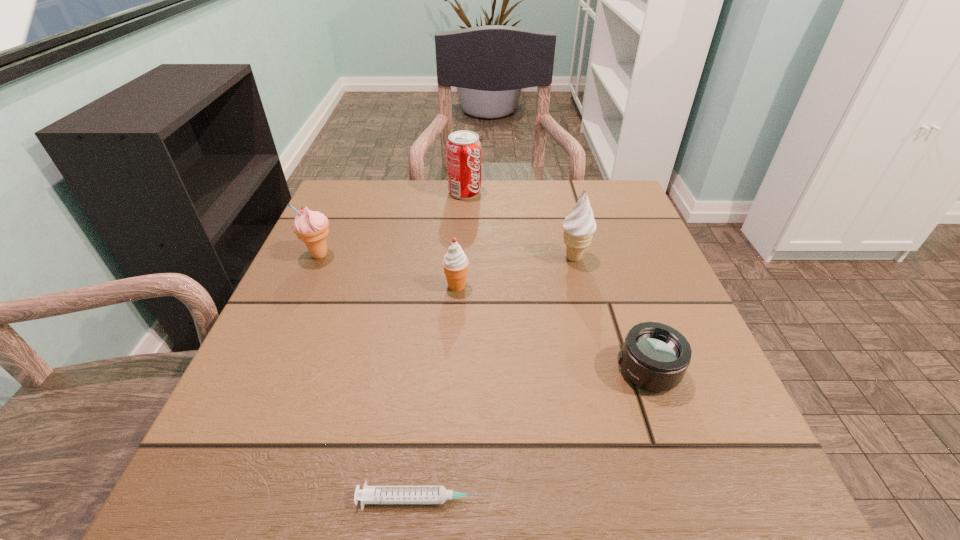
Find the location of a particular element. the rightmost icecream is located at coordinates (579, 227).

Find the location of a particular element. This screenshot has width=960, height=540. soda can is located at coordinates (463, 148).

Identify the location of the leftmost icecream. This screenshot has width=960, height=540. (311, 227).

The height and width of the screenshot is (540, 960). Identify the location of the nearest icecream. (455, 262).

This screenshot has height=540, width=960. Identify the location of the third nearest object. (455, 262).

I want to click on the fifth farthest object, so click(655, 357).

The image size is (960, 540). Identify the location of the fifth tallest object. (655, 357).

The image size is (960, 540). I want to click on the nearest object, so click(x=370, y=494).

What are the coordinates of `syringe` in the screenshot? It's located at (370, 494).

Locate an element on the screen. free space located 0.380m on the front-facing side of the rightmost icecream is located at coordinates point(381,258).